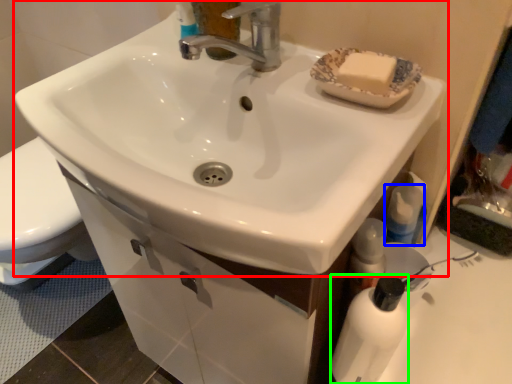
Question: Which is farther away from sink (highlighted by a red box)? mouthwash (highlighted by a blue box) or bottle (highlighted by a green box)?

Choices:
 (A) mouthwash
 (B) bottle

Answer: (A)